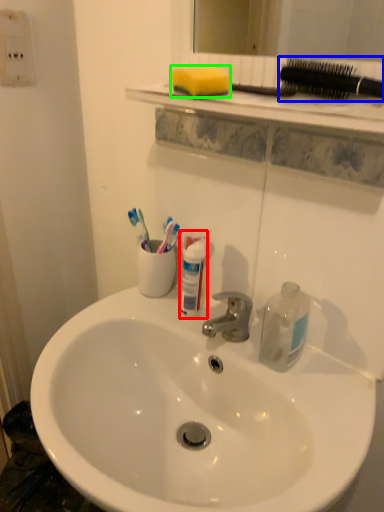
Question: Estimate the real-world distances between objects in this image. Which object is farther from toiletry (highlighted by a red box), brush (highlighted by a blue box) or soap (highlighted by a green box)?

Choices:
 (A) brush
 (B) soap

Answer: (A)